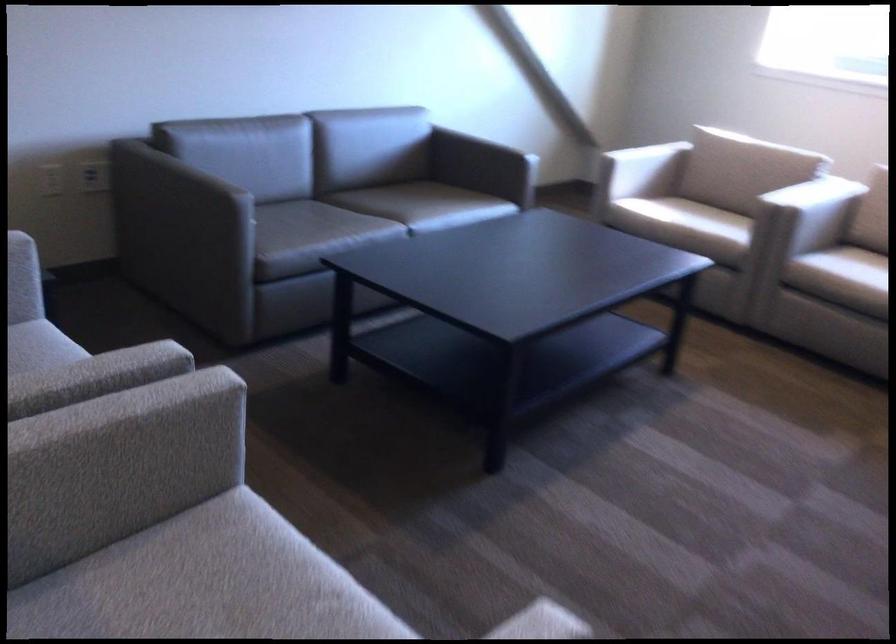
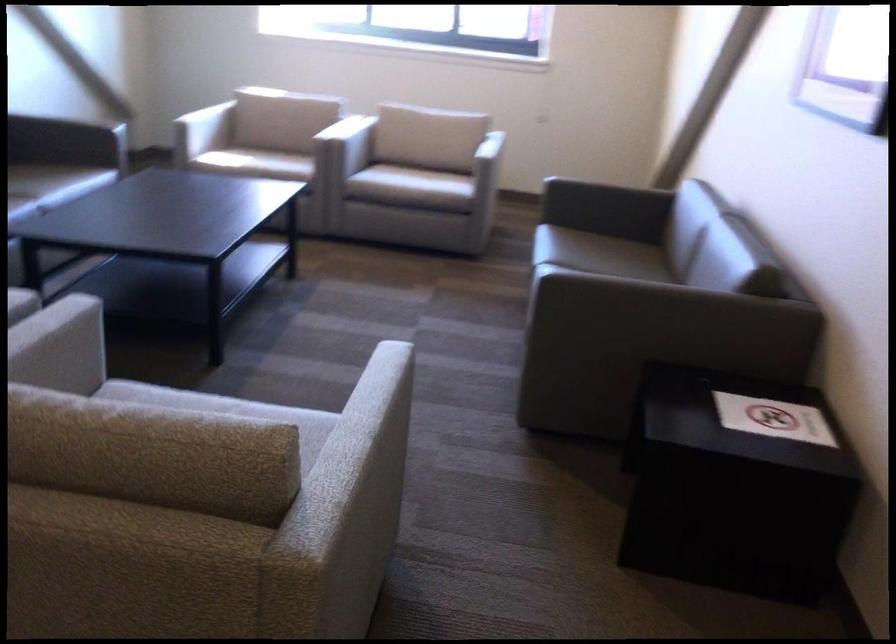
In the second image, find the point that corresponds to [807,230] in the first image.

(347, 145)